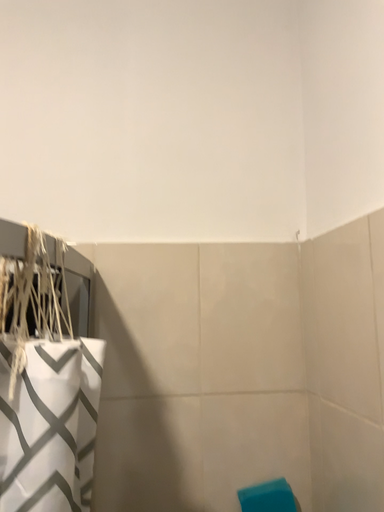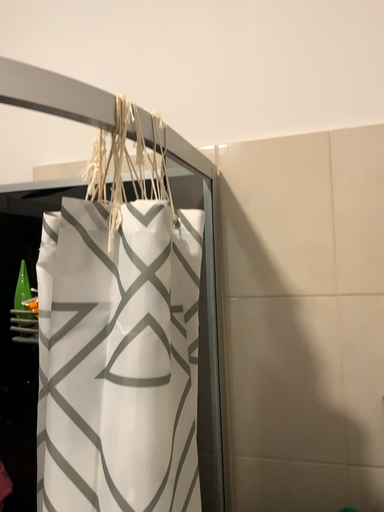
Question: How did the camera likely rotate when shooting the video?

Choices:
 (A) rotated left
 (B) rotated right

Answer: (A)